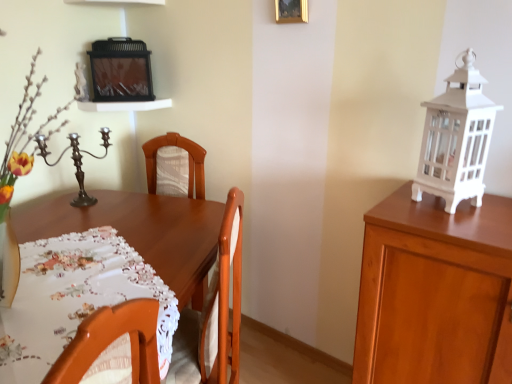
Locate an element on the screen. free point above white printed tablecloth at center (from a real-world perspective) is located at coordinates (76, 281).